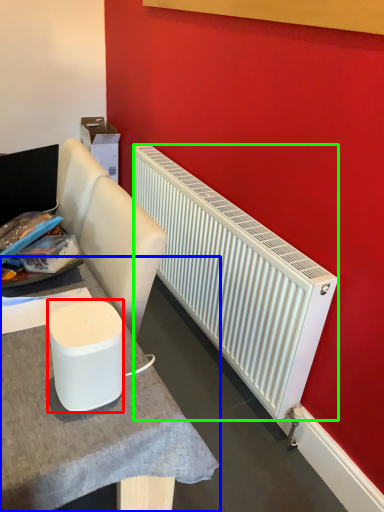
Question: Which is nearer to the appliance (highlighted by a red box)? table (highlighted by a blue box) or radiator (highlighted by a green box).

Choices:
 (A) table
 (B) radiator

Answer: (A)